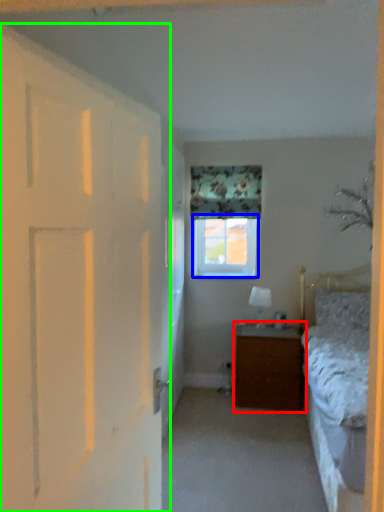
Question: Which object is the closest to the nightstand (highlighted by a red box)? Choose among these: window (highlighted by a blue box) or door (highlighted by a green box).

Choices:
 (A) window
 (B) door

Answer: (A)